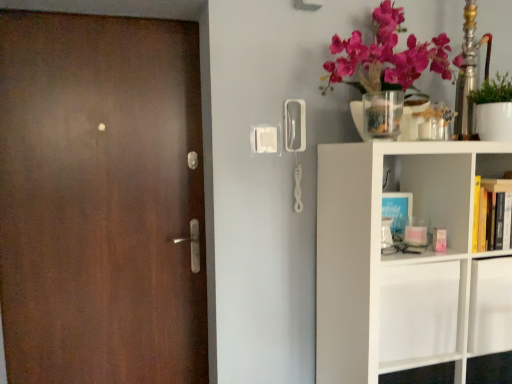
Question: From the image's perspective, is matte brown door at left positioned above or below green matte plant at upper right?

Choices:
 (A) above
 (B) below

Answer: (B)

Question: Relative to green matte plant at upper right, is matte brown door at left in front or behind?

Choices:
 (A) behind
 (B) front

Answer: (A)

Question: Estimate the real-world distances between objects in this image. Which object is farther from the white matte shelf at right?

Choices:
 (A) clear glass vase at upper right
 (B) green matte plant at upper right
 (C) matte brown door at left

Answer: (C)

Question: Which object is the farthest from the white matte shelf at right?

Choices:
 (A) matte brown door at left
 (B) green matte plant at upper right
 (C) clear glass vase at upper right

Answer: (A)